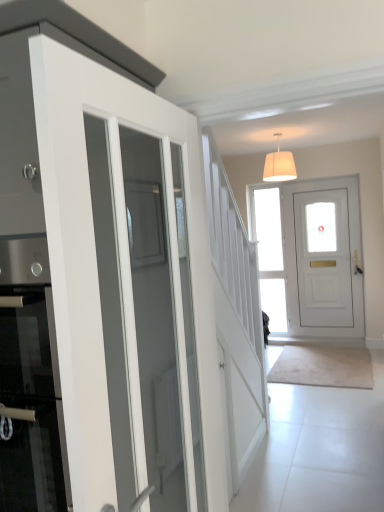
Question: Considering their positions, is white matte door at center, the 1th door from the right, located in front of or behind white glossy door at left, which is the 1th door from left to right?

Choices:
 (A) behind
 (B) front

Answer: (A)

Question: From a real-world perspective, is white matte door at center, the 1th door viewed from the back, above or below white glossy door at left, arranged as the first door when viewed from the front?

Choices:
 (A) above
 (B) below

Answer: (B)

Question: Which object is positioned closest to the white fabric lampshade at upper center?

Choices:
 (A) white glossy door at left, marked as the second door in a right-to-left arrangement
 (B) clear glass door at center
 (C) white matte door at center, the second door from the left

Answer: (C)

Question: Estimate the real-world distances between objects in this image. Which object is farther from the clear glass door at center?

Choices:
 (A) white matte door at center, the second door positioned from the front
 (B) white fabric lampshade at upper center
 (C) white glossy door at left, which ranks as the 2th door in back-to-front order

Answer: (C)